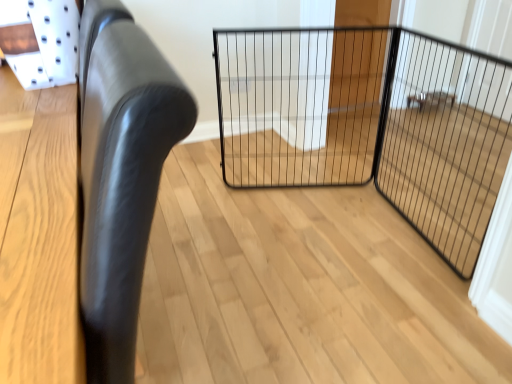
From the picture: What is the approximate width of black wire mesh gate at center?

It is 4.41 inches.

Where is `black leather chair at left`? The image size is (512, 384). black leather chair at left is located at coordinates (121, 174).

Is black leather chair at left in front of or behind black wire mesh gate at center in the image?

In the image, black leather chair at left appears in front of black wire mesh gate at center.

Can you confirm if black leather chair at left is positioned to the left of black wire mesh gate at center?

Yes.

Is black leather chair at left situated inside black wire mesh gate at center or outside?

black leather chair at left exists outside the volume of black wire mesh gate at center.

Considering the positions of point (102, 345) and point (349, 68), is point (102, 345) closer or farther from the camera than point (349, 68)?

Point (102, 345).

Which is closer, (431, 228) or (231, 63)?

Point (431, 228)

Between black wire mesh screen door at center and black wire mesh gate at center, which one appears on the left side from the viewer's perspective?

black wire mesh gate at center.

Where is `screen door above the black wire mesh gate at center (from a real-world perspective)`? screen door above the black wire mesh gate at center (from a real-world perspective) is located at coordinates (446, 143).

How different are the orientations of black wire mesh screen door at center and black wire mesh gate at center in degrees?

78.1 degrees separate the facing orientations of black wire mesh screen door at center and black wire mesh gate at center.

Between black leather chair at left and black wire mesh screen door at center, which one has smaller size?

With smaller size is black wire mesh screen door at center.

What's the angular difference between black leather chair at left and black wire mesh screen door at center's facing directions?

The angular difference between black leather chair at left and black wire mesh screen door at center is 7.3 degrees.

Does black leather chair at left have a lesser height compared to black wire mesh screen door at center?

In fact, black leather chair at left may be taller than black wire mesh screen door at center.

From a real-world perspective, who is located higher, black leather chair at left or black wire mesh screen door at center?

black leather chair at left is physically above.

Which of these two, black wire mesh gate at center or black leather chair at left, is bigger?

black leather chair at left is bigger.

Based on the photo, are black wire mesh gate at center and black leather chair at left far apart?

That's right, there is a large distance between black wire mesh gate at center and black leather chair at left.

I want to click on cage on the right of black leather chair at left, so click(x=298, y=105).

Does black wire mesh gate at center turn towards black wire mesh screen door at center?

Yes.

Based on their positions, is black wire mesh gate at center located to the left or right of black wire mesh screen door at center?

black wire mesh gate at center is positioned on black wire mesh screen door at center's left side.

Considering the sizes of objects black wire mesh gate at center and black wire mesh screen door at center in the image provided, who is wider, black wire mesh gate at center or black wire mesh screen door at center?

black wire mesh gate at center.

Choose the correct answer: Is black wire mesh gate at center inside black wire mesh screen door at center or outside it?

black wire mesh gate at center is spatially situated outside black wire mesh screen door at center.

Is black wire mesh screen door at center in front of or behind black leather chair at left in the image?

In the image, black wire mesh screen door at center appears behind black leather chair at left.

Between black wire mesh screen door at center and black leather chair at left, which one has more height?

With more height is black leather chair at left.

Could you tell me if black wire mesh screen door at center is turned towards black leather chair at left?

Yes, black wire mesh screen door at center is oriented towards black leather chair at left.

Do you think black wire mesh screen door at center is within black leather chair at left, or outside of it?

black wire mesh screen door at center is located beyond the bounds of black leather chair at left.

Find the location of a particular element. The image size is (512, 384). cage on the right of black leather chair at left is located at coordinates (298, 105).

The height and width of the screenshot is (384, 512). Identify the location of cage above the black wire mesh screen door at center (from the image's perspective). pyautogui.click(x=298, y=105).

From the image, which object appears to be nearer to black wire mesh gate at center, black wire mesh screen door at center or black leather chair at left?

The object closer to black wire mesh gate at center is black wire mesh screen door at center.

Based on the photo, estimate the real-world distances between objects in this image. Which object is closer to black wire mesh screen door at center, black leather chair at left or black wire mesh gate at center?

black wire mesh gate at center lies closer to black wire mesh screen door at center than the other object.

Which object lies nearer to the anchor point black leather chair at left, black wire mesh gate at center or black wire mesh screen door at center?

The object closer to black leather chair at left is black wire mesh gate at center.

Which object lies further to the anchor point black wire mesh gate at center, black leather chair at left or black wire mesh screen door at center?

black leather chair at left lies further to black wire mesh gate at center than the other object.

From the image, which object appears to be nearer to black wire mesh screen door at center, black wire mesh gate at center or black leather chair at left?

black wire mesh gate at center is positioned closer to the anchor black wire mesh screen door at center.

Estimate the real-world distances between objects in this image. Which object is closer to black leather chair at left, black wire mesh screen door at center or black wire mesh gate at center?

black wire mesh gate at center is positioned closer to the anchor black leather chair at left.

Locate an element on the screen. cage situated between black leather chair at left and black wire mesh screen door at center from left to right is located at coordinates (298, 105).